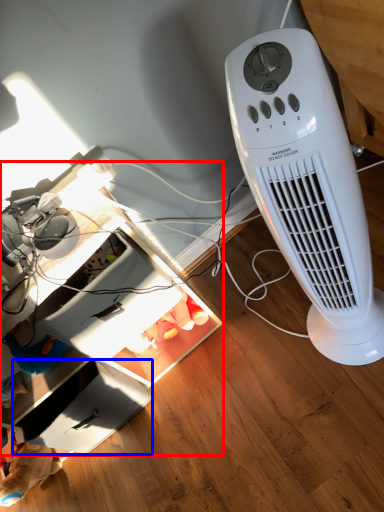
Question: Which object appears closest to the camera in this image, computer desk (highlighted by a red box) or drawer (highlighted by a blue box)?

Choices:
 (A) computer desk
 (B) drawer

Answer: (A)